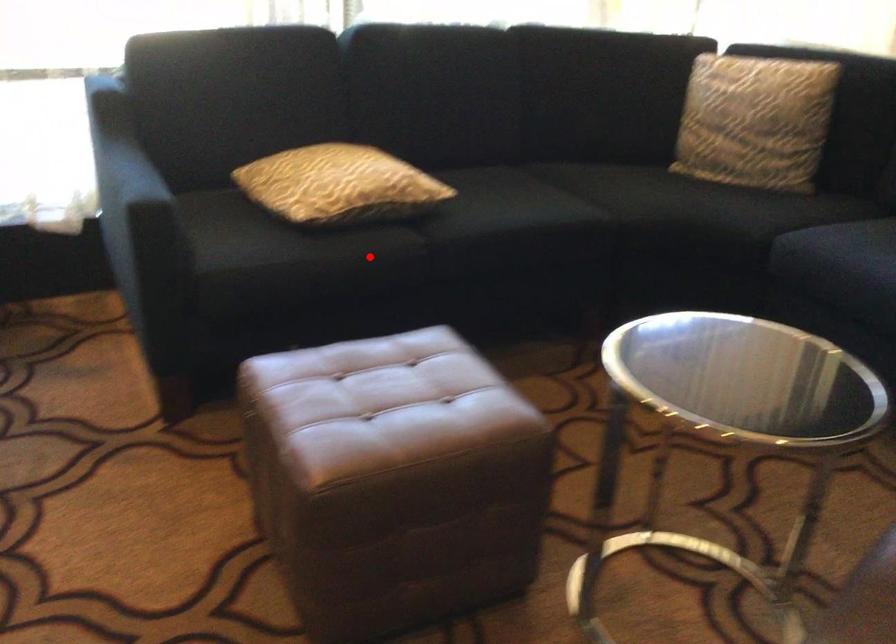
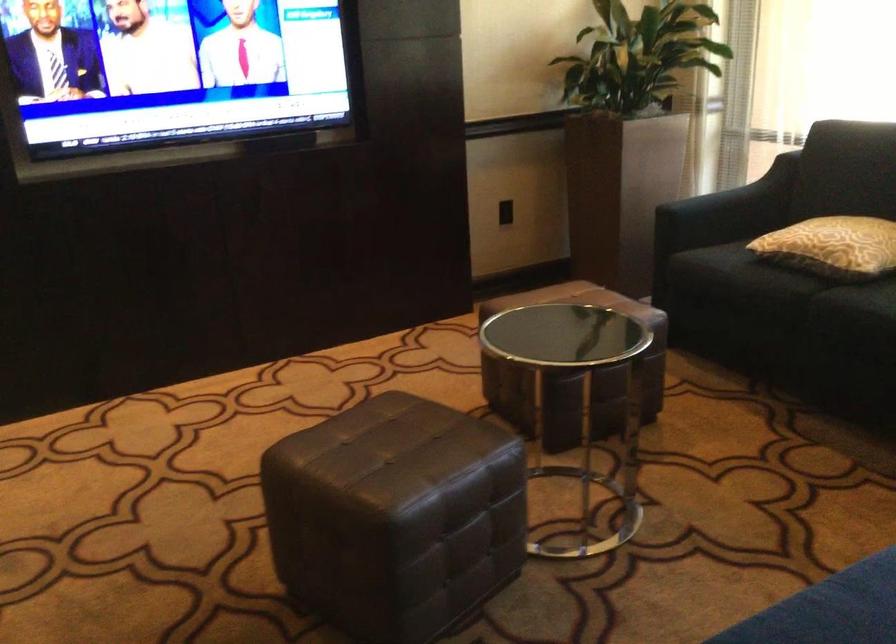
Find the pixel in the second image that matches the highlighted location in the first image.

(767, 283)